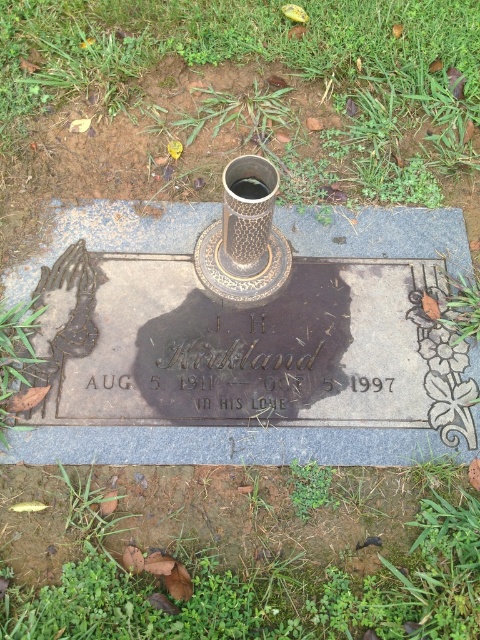
Is green grass at center closer to the viewer compared to green grass at lower center?

No, it is not.

Where is `green grass at center`? green grass at center is located at coordinates click(238, 97).